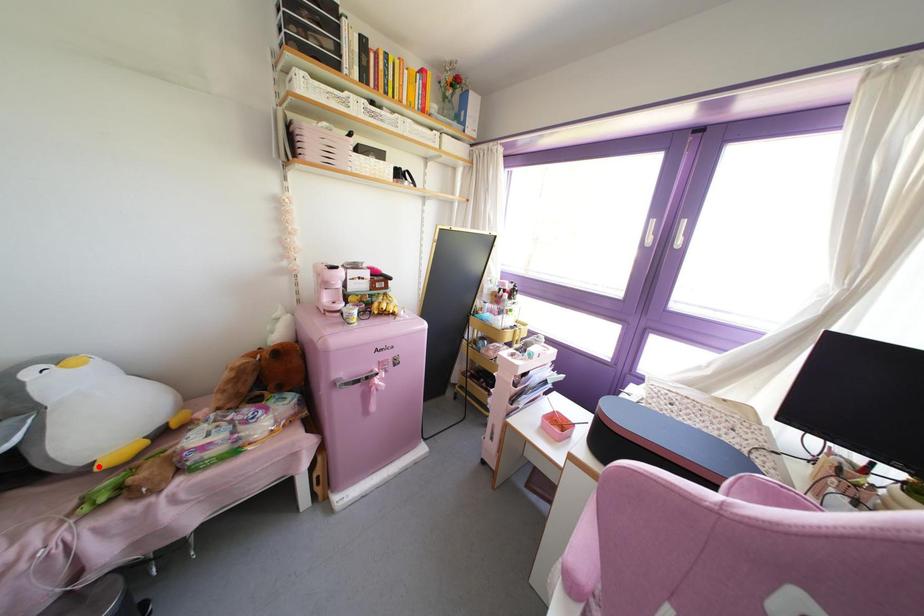
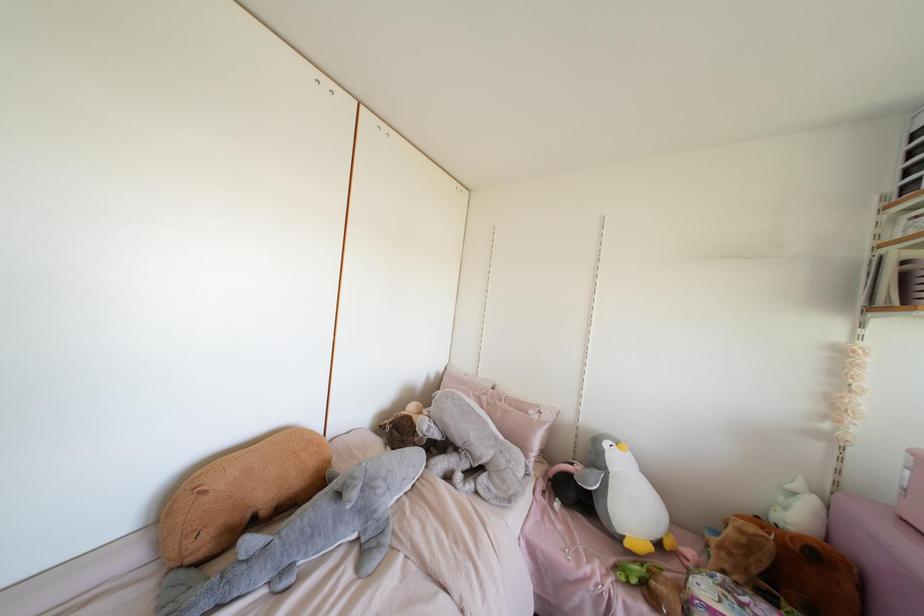
Question: I am providing you with two images of the same scene from different viewpoints. Image1 has a red point marked. In image2, the corresponding 3D location appears at what relative position? Reply with the corresponding letter.

Choices:
 (A) Closer
 (B) Farther

Answer: (B)